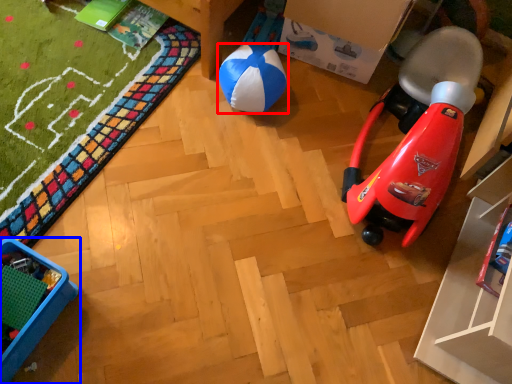
Question: Which of the following is the closest to the observer, ball (highlighted by a red box) or furniture (highlighted by a blue box)?

Choices:
 (A) ball
 (B) furniture

Answer: (B)